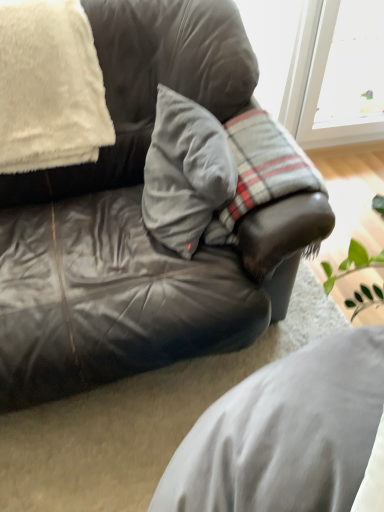
In order to face gray cotton pillow at center, positioned as the 1th pillow in right-to-left order, should I rotate leftwards or rightwards?

It's best to rotate right around 0.871 degrees.

Describe the element at coordinates (285, 434) in the screenshot. This screenshot has height=512, width=384. I see `leather cushion at center` at that location.

Find the location of a particular element. white fluffy blanket at upper left, positioned as the 2th pillow in right-to-left order is located at coordinates (49, 87).

In the scene shown: Can we say leather cushion at center lies outside white fluffy blanket at upper left, positioned as the 2th pillow in right-to-left order?

leather cushion at center lies outside white fluffy blanket at upper left, positioned as the 2th pillow in right-to-left order,'s area.

Considering the positions of objects leather cushion at center and white fluffy blanket at upper left, positioned as the 2th pillow in right-to-left order, in the image provided, who is in front, leather cushion at center or white fluffy blanket at upper left, positioned as the 2th pillow in right-to-left order,?

Positioned in front is leather cushion at center.

Looking at this image, is leather cushion at center to the left of white fluffy blanket at upper left, which ranks as the first pillow in left-to-right order, from the viewer's perspective?

Incorrect, leather cushion at center is not on the left side of white fluffy blanket at upper left, which ranks as the first pillow in left-to-right order.

Is leather cushion at center not near white fluffy blanket at upper left, positioned as the 2th pillow in right-to-left order?

Answer: No.

Is white fluffy blanket at upper left, which ranks as the first pillow in left-to-right order, spatially inside gray cotton pillow at center, positioned as the 1th pillow in right-to-left order, or outside of it?

white fluffy blanket at upper left, which ranks as the first pillow in left-to-right order, is not inside gray cotton pillow at center, positioned as the 1th pillow in right-to-left order, it's outside.

From a real-world perspective, is white fluffy blanket at upper left, positioned as the 2th pillow in right-to-left order, physically located above or below gray cotton pillow at center, positioned as the 1th pillow in right-to-left order?

In terms of real-world spatial position, white fluffy blanket at upper left, positioned as the 2th pillow in right-to-left order, is above gray cotton pillow at center, positioned as the 1th pillow in right-to-left order.

How different are the orientations of white fluffy blanket at upper left, which ranks as the first pillow in left-to-right order, and gray cotton pillow at center, the 2th pillow when ordered from left to right, in degrees?

The angle between the facing direction of white fluffy blanket at upper left, which ranks as the first pillow in left-to-right order, and the facing direction of gray cotton pillow at center, the 2th pillow when ordered from left to right, is 94.8 degrees.

Does white fluffy blanket at upper left, which ranks as the first pillow in left-to-right order, touch gray cotton pillow at center, the 2th pillow when ordered from left to right?

There is a gap between white fluffy blanket at upper left, which ranks as the first pillow in left-to-right order, and gray cotton pillow at center, the 2th pillow when ordered from left to right.

Is gray cotton pillow at center, positioned as the 1th pillow in right-to-left order, to the left of leather cushion at center from the viewer's perspective?

Yes.

Is gray cotton pillow at center, the 2th pillow when ordered from left to right, not inside leather cushion at center?

Yes, gray cotton pillow at center, the 2th pillow when ordered from left to right, is not within leather cushion at center.

From the image's perspective, starting from the leather cushion at center, which pillow is the 1st one above? Please provide its 2D coordinates.

[(185, 172)]

Where is `pillow that is the 2nd object located above the leather cushion at center (from the image's perspective)`? This screenshot has width=384, height=512. pillow that is the 2nd object located above the leather cushion at center (from the image's perspective) is located at coordinates (49, 87).

Which is behind, white fluffy blanket at upper left, which ranks as the first pillow in left-to-right order, or leather cushion at center?

white fluffy blanket at upper left, which ranks as the first pillow in left-to-right order, is more distant.

Is white fluffy blanket at upper left, which ranks as the first pillow in left-to-right order, oriented away from leather cushion at center?

No, white fluffy blanket at upper left, which ranks as the first pillow in left-to-right order,'s orientation is not away from leather cushion at center.

Which object is wider, gray cotton pillow at center, the 2th pillow when ordered from left to right, or matte gray leather couch at center?

Wider between the two is matte gray leather couch at center.

Is gray cotton pillow at center, positioned as the 1th pillow in right-to-left order, to the right of matte gray leather couch at center from the viewer's perspective?

Yes, gray cotton pillow at center, positioned as the 1th pillow in right-to-left order, is to the right of matte gray leather couch at center.

Which point is more forward, (214,140) or (6,358)?

The point (6,358) is in front.

Is gray cotton pillow at center, positioned as the 1th pillow in right-to-left order, facing away from matte gray leather couch at center?

Yes, gray cotton pillow at center, positioned as the 1th pillow in right-to-left order,'s orientation is away from matte gray leather couch at center.

Is matte gray leather couch at center inside the boundaries of white fluffy blanket at upper left, positioned as the 2th pillow in right-to-left order, or outside?

matte gray leather couch at center cannot be found inside white fluffy blanket at upper left, positioned as the 2th pillow in right-to-left order.

Is point (70, 207) positioned behind point (8, 30)?

Yes, point (70, 207) is behind point (8, 30).

Is matte gray leather couch at center oriented towards white fluffy blanket at upper left, which ranks as the first pillow in left-to-right order?

No, matte gray leather couch at center is not facing towards white fluffy blanket at upper left, which ranks as the first pillow in left-to-right order.

Identify the location of studio couch that is below the white fluffy blanket at upper left, which ranks as the first pillow in left-to-right order (from the image's perspective). The image size is (384, 512). (125, 224).

Measure the distance from white fluffy blanket at upper left, which ranks as the first pillow in left-to-right order, to matte gray leather couch at center.

23.06 centimeters.

How different are the orientations of white fluffy blanket at upper left, which ranks as the first pillow in left-to-right order, and matte gray leather couch at center in degrees?

The angle between the facing direction of white fluffy blanket at upper left, which ranks as the first pillow in left-to-right order, and the facing direction of matte gray leather couch at center is 0.523 degrees.

Is white fluffy blanket at upper left, positioned as the 2th pillow in right-to-left order, looking in the opposite direction of matte gray leather couch at center?

Absolutely, white fluffy blanket at upper left, positioned as the 2th pillow in right-to-left order, is directed away from matte gray leather couch at center.

Is point (104, 133) farther from camera compared to point (119, 34)?

Yes, point (104, 133) is behind point (119, 34).

The image size is (384, 512). Identify the location of pillow that is the 2nd one above the leather cushion at center (from a real-world perspective). (49, 87).

Identify the location of pillow below the white fluffy blanket at upper left, positioned as the 2th pillow in right-to-left order (from a real-world perspective). The image size is (384, 512). (185, 172).

Based on their spatial positions, is leather cushion at center or matte gray leather couch at center closer to white fluffy blanket at upper left, which ranks as the first pillow in left-to-right order?

Based on the image, matte gray leather couch at center appears to be nearer to white fluffy blanket at upper left, which ranks as the first pillow in left-to-right order.

From the image, which object appears to be farther from white fluffy blanket at upper left, positioned as the 2th pillow in right-to-left order, gray cotton pillow at center, the 2th pillow when ordered from left to right, or matte gray leather couch at center?

gray cotton pillow at center, the 2th pillow when ordered from left to right, lies further to white fluffy blanket at upper left, positioned as the 2th pillow in right-to-left order, than the other object.

Which object lies nearer to the anchor point leather cushion at center, white fluffy blanket at upper left, positioned as the 2th pillow in right-to-left order, or gray cotton pillow at center, the 2th pillow when ordered from left to right?

Based on the image, gray cotton pillow at center, the 2th pillow when ordered from left to right, appears to be nearer to leather cushion at center.

Which object lies further to the anchor point gray cotton pillow at center, positioned as the 1th pillow in right-to-left order, leather cushion at center or white fluffy blanket at upper left, positioned as the 2th pillow in right-to-left order?

leather cushion at center lies further to gray cotton pillow at center, positioned as the 1th pillow in right-to-left order, than the other object.

Looking at the image, which one is located closer to gray cotton pillow at center, the 2th pillow when ordered from left to right, matte gray leather couch at center or white fluffy blanket at upper left, which ranks as the first pillow in left-to-right order?

matte gray leather couch at center is positioned closer to the anchor gray cotton pillow at center, the 2th pillow when ordered from left to right.

Which object lies nearer to the anchor point leather cushion at center, gray cotton pillow at center, the 2th pillow when ordered from left to right, or white fluffy blanket at upper left, positioned as the 2th pillow in right-to-left order?

gray cotton pillow at center, the 2th pillow when ordered from left to right, is closer to leather cushion at center.

Estimate the real-world distances between objects in this image. Which object is further from matte gray leather couch at center, leather cushion at center or white fluffy blanket at upper left, positioned as the 2th pillow in right-to-left order?

leather cushion at center is positioned further to the anchor matte gray leather couch at center.

From the image, which object appears to be nearer to matte gray leather couch at center, white fluffy blanket at upper left, positioned as the 2th pillow in right-to-left order, or leather cushion at center?

Among the two, white fluffy blanket at upper left, positioned as the 2th pillow in right-to-left order, is located nearer to matte gray leather couch at center.

You are a GUI agent. You are given a task and a screenshot of the screen. Output one action in this format:
    pyautogui.click(x=<x>, y=<y>)
    Task: Click on the studio couch between gray cotton pillow at center, the 2th pillow when ordered from left to right, and leather cushion at center, in the vertical direction
    
    Given the screenshot: What is the action you would take?
    pyautogui.click(x=125, y=224)

I want to click on studio couch between white fluffy blanket at upper left, positioned as the 2th pillow in right-to-left order, and leather cushion at center vertically, so click(x=125, y=224).

The height and width of the screenshot is (512, 384). Identify the location of pillow positioned between matte gray leather couch at center and white fluffy blanket at upper left, which ranks as the first pillow in left-to-right order, from near to far. (185, 172).

Image resolution: width=384 pixels, height=512 pixels. What are the coordinates of `pillow between white fluffy blanket at upper left, which ranks as the first pillow in left-to-right order, and leather cushion at center from top to bottom` in the screenshot? It's located at (185, 172).